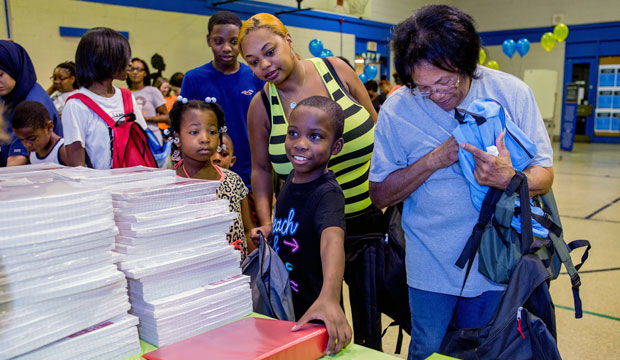
Where is `floor`? This screenshot has height=360, width=620. floor is located at coordinates (598, 223).